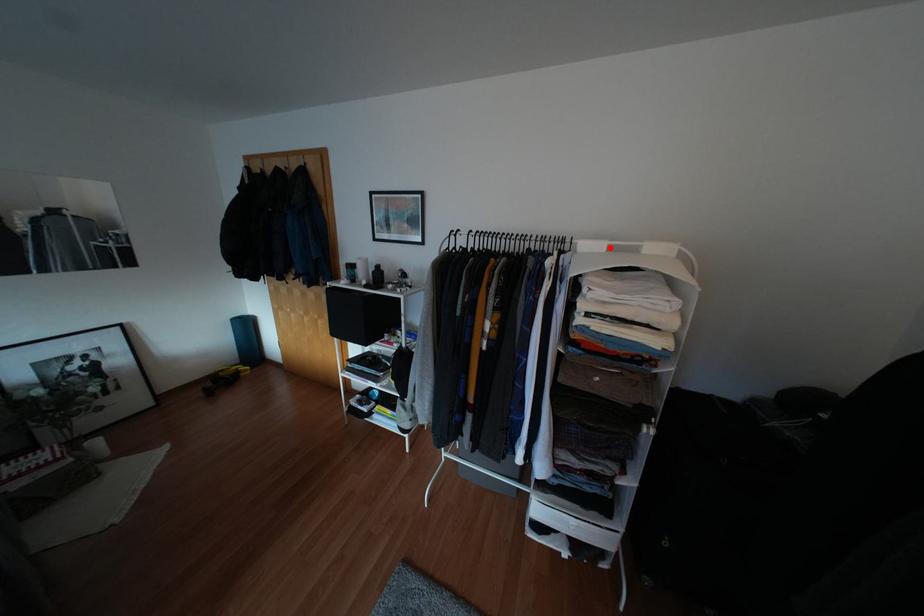
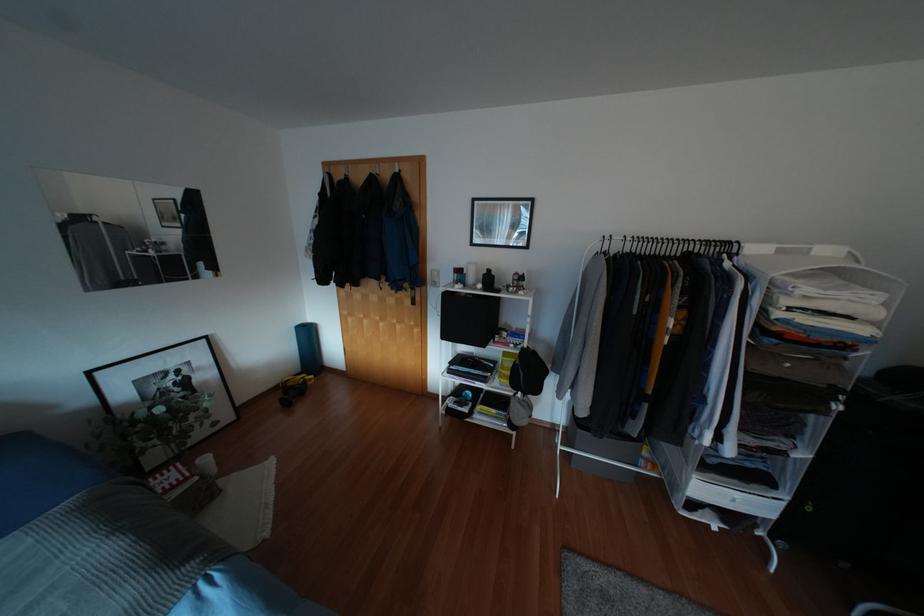
Find the pixel in the second image that matches the highlighted location in the first image.

(779, 251)